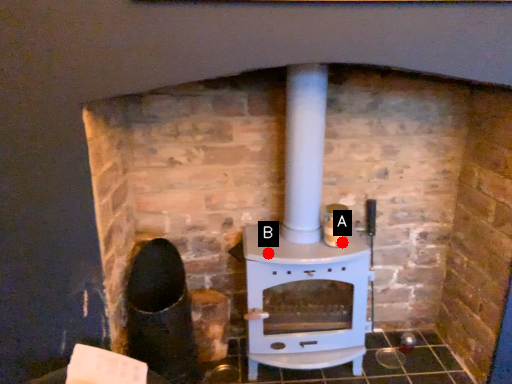
Question: Two points are circled on the image, labeled by A and B beside each circle. Among these points, which one is nearest to the camera?

Choices:
 (A) A is closer
 (B) B is closer

Answer: (B)